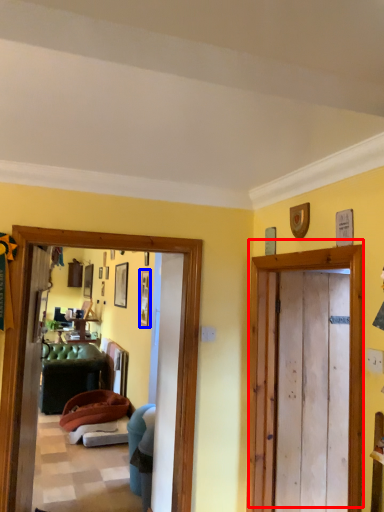
Question: Which point is further to the camera, door (highlighted by a red box) or picture frame (highlighted by a blue box)?

Choices:
 (A) door
 (B) picture frame

Answer: (B)